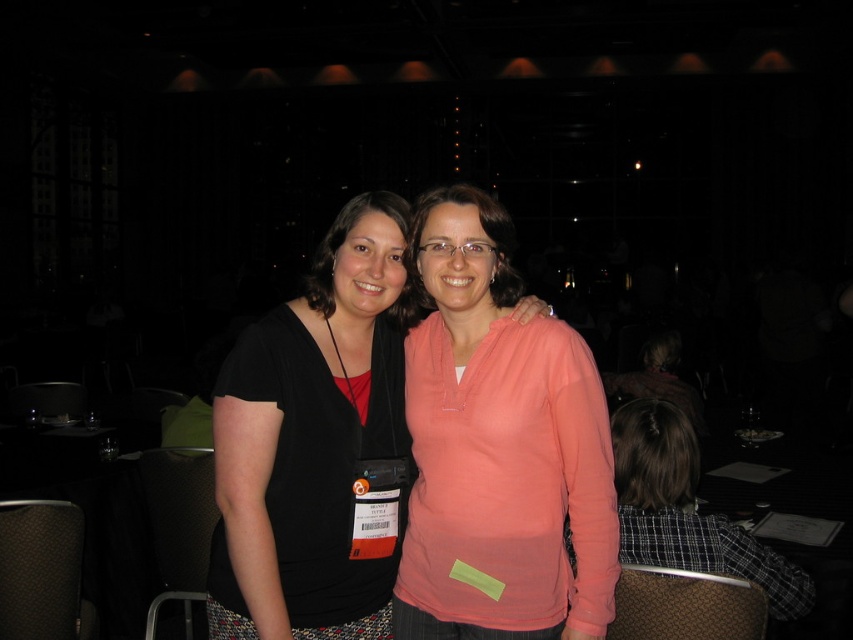
Question: Which point is closer to the camera?

Choices:
 (A) matte black shirt at center
 (B) matte pink hoodie at center

Answer: (A)

Question: In this image, where is matte pink hoodie at center located relative to matte black shirt at center?

Choices:
 (A) right
 (B) left

Answer: (A)

Question: Which point appears farthest from the camera in this image?

Choices:
 (A) (311, 426)
 (B) (438, 492)

Answer: (B)

Question: Among these objects, which one is nearest to the camera?

Choices:
 (A) matte pink hoodie at center
 (B) matte black shirt at center

Answer: (B)

Question: Does matte pink hoodie at center appear under matte black shirt at center?

Choices:
 (A) no
 (B) yes

Answer: (B)

Question: Can you confirm if matte pink hoodie at center is positioned below matte black shirt at center?

Choices:
 (A) no
 (B) yes

Answer: (B)